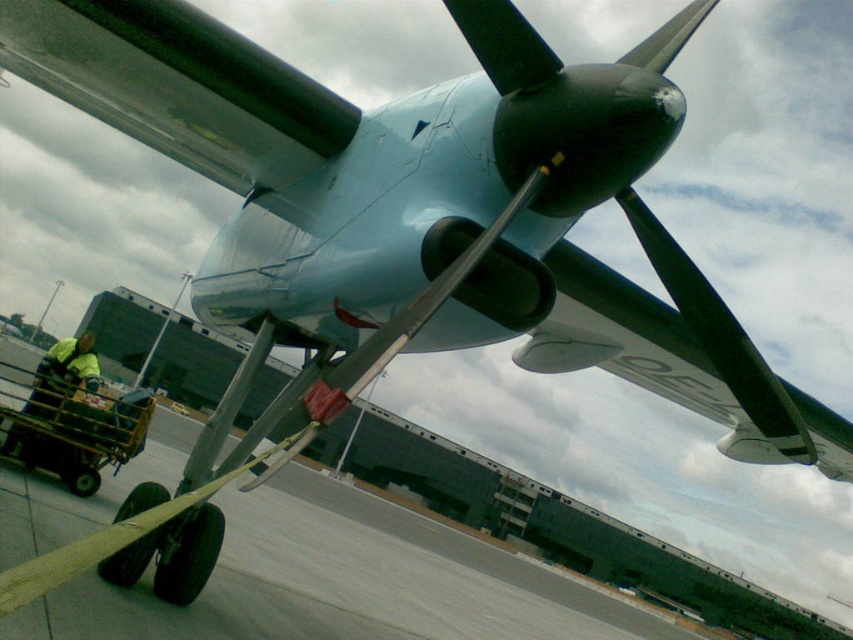
You are a pilot standing at the center of the aircraft nose section. You need to locate the metallic yellow cart at lower left. According to the coordinates provided, in which direction should you look to find it?

The metallic yellow cart at lower left is located at point coordinates, so you should look to the lower left direction from the aircraft nose section to find it.

You are an airport staff member standing on the tarmac and need to move both the metallic yellow cart at lower left and the yellow reflective vest at lower left to the baggage area. Since you can only carry one item at a time, which item should you move first if you want to finish faster?

The metallic yellow cart at lower left is larger in size than the yellow reflective vest at lower left, so you should move the yellow reflective vest at lower left first since it is smaller and easier to carry quickly.